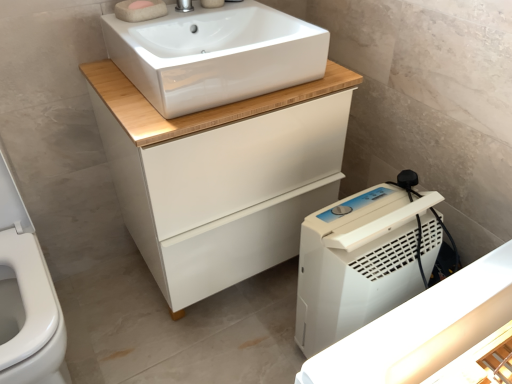
What are the coordinates of `pink sponge at upper center` in the screenshot? It's located at (140, 4).

The image size is (512, 384). What do you see at coordinates (140, 4) in the screenshot?
I see `pink sponge at upper center` at bounding box center [140, 4].

The width and height of the screenshot is (512, 384). What are the coordinates of `white plastic dehumidifier at lower right` in the screenshot? It's located at (361, 262).

Where is `white glossy sink at upper center`? white glossy sink at upper center is located at coordinates (215, 55).

This screenshot has width=512, height=384. In order to click on pink sponge at upper center in this screenshot , I will do `click(140, 4)`.

Can you confirm if pink sponge at upper center is bigger than silver metallic tap at upper center?

Incorrect, pink sponge at upper center is not larger than silver metallic tap at upper center.

The height and width of the screenshot is (384, 512). What are the coordinates of `tap that appears on the right of pink sponge at upper center` in the screenshot? It's located at (184, 6).

Is pink sponge at upper center oriented away from silver metallic tap at upper center?

No.

Do you think pink sponge at upper center is within silver metallic tap at upper center, or outside of it?

pink sponge at upper center is not inside silver metallic tap at upper center, it's outside.

Is pink sponge at upper center looking in the opposite direction of white glossy sink at upper center?

Yes.

How many degrees apart are the facing directions of pink sponge at upper center and white glossy sink at upper center?

The angle between the facing direction of pink sponge at upper center and the facing direction of white glossy sink at upper center is 3.8 degrees.

Is pink sponge at upper center situated inside white glossy sink at upper center or outside?

The correct answer is: inside.

Is pink sponge at upper center not near white glossy sink at upper center?

pink sponge at upper center is near white glossy sink at upper center, not far away.

From the image's perspective, is white plastic dehumidifier at lower right above or below silver metallic tap at upper center?

Clearly, from the image's perspective, white plastic dehumidifier at lower right is below silver metallic tap at upper center.

Is white plastic dehumidifier at lower right positioned with its back to silver metallic tap at upper center?

No, white plastic dehumidifier at lower right is not facing the opposite direction of silver metallic tap at upper center.

Which of these two, white plastic dehumidifier at lower right or silver metallic tap at upper center, is bigger?

white plastic dehumidifier at lower right is bigger.

From a real-world perspective, is silver metallic tap at upper center beneath white plastic dehumidifier at lower right?

No, from a real-world perspective, silver metallic tap at upper center is not below white plastic dehumidifier at lower right.

From the image's perspective, which one is positioned lower, silver metallic tap at upper center or white plastic dehumidifier at lower right?

white plastic dehumidifier at lower right is shown below in the image.

Can you see silver metallic tap at upper center touching white plastic dehumidifier at lower right?

No, silver metallic tap at upper center is not in contact with white plastic dehumidifier at lower right.

Is silver metallic tap at upper center positioned with its back to white plastic dehumidifier at lower right?

No.

From a real-world perspective, is pink sponge at upper center beneath white matte cabinet at center?

No.

Can you confirm if pink sponge at upper center is taller than white matte cabinet at center?

No.

From the image's perspective, which is above, pink sponge at upper center or white matte cabinet at center?

pink sponge at upper center, from the image's perspective.

Is white matte cabinet at center inside pink sponge at upper center?

Actually, white matte cabinet at center is outside pink sponge at upper center.

Which is in front, point (119, 85) or point (138, 7)?

Point (119, 85)

Considering the relative sizes of white matte cabinet at center and pink sponge at upper center in the image provided, is white matte cabinet at center shorter than pink sponge at upper center?

In fact, white matte cabinet at center may be taller than pink sponge at upper center.

From the image's perspective, is white matte cabinet at center located above or below pink sponge at upper center?

Based on their image positions, white matte cabinet at center is located beneath pink sponge at upper center.

At what (x,y) coordinates should I click in order to perform the action: click on tap on the right side of pink sponge at upper center. Please return your answer as a coordinate pair (x, y). This screenshot has height=384, width=512. Looking at the image, I should click on (184, 6).

Is silver metallic tap at upper center not inside pink sponge at upper center?

Yes, silver metallic tap at upper center is located beyond the bounds of pink sponge at upper center.

Is silver metallic tap at upper center bigger or smaller than pink sponge at upper center?

In the image, silver metallic tap at upper center appears to be larger than pink sponge at upper center.

This screenshot has height=384, width=512. I want to click on tap above the pink sponge at upper center (from the image's perspective), so click(x=184, y=6).

Find the location of a particular element. sink below the pink sponge at upper center (from the image's perspective) is located at coordinates (215, 55).

Which object lies nearer to the anchor point white matte cabinet at center, white plastic dehumidifier at lower right or pink sponge at upper center?

white plastic dehumidifier at lower right is positioned closer to the anchor white matte cabinet at center.

From the image, which object appears to be farther from white matte cabinet at center, silver metallic tap at upper center or white glossy sink at upper center?

The object further to white matte cabinet at center is silver metallic tap at upper center.

Which object lies nearer to the anchor point white matte cabinet at center, pink sponge at upper center or silver metallic tap at upper center?

Based on the image, silver metallic tap at upper center appears to be nearer to white matte cabinet at center.

From the image, which object appears to be farther from pink sponge at upper center, white glossy sink at upper center or silver metallic tap at upper center?

The object further to pink sponge at upper center is white glossy sink at upper center.

When comparing their distances from white glossy sink at upper center, does white plastic dehumidifier at lower right or pink sponge at upper center seem closer?

pink sponge at upper center is positioned closer to the anchor white glossy sink at upper center.

Which object lies further to the anchor point silver metallic tap at upper center, white plastic dehumidifier at lower right or pink sponge at upper center?

white plastic dehumidifier at lower right.

When comparing their distances from white plastic dehumidifier at lower right, does white matte cabinet at center or silver metallic tap at upper center seem further?

Based on the image, silver metallic tap at upper center appears to be further to white plastic dehumidifier at lower right.

When comparing their distances from white plastic dehumidifier at lower right, does white glossy sink at upper center or white matte cabinet at center seem closer?

The object closer to white plastic dehumidifier at lower right is white matte cabinet at center.

Image resolution: width=512 pixels, height=384 pixels. I want to click on sink that lies between pink sponge at upper center and white matte cabinet at center from top to bottom, so click(215, 55).

Locate an element on the screen. The height and width of the screenshot is (384, 512). sink between silver metallic tap at upper center and white matte cabinet at center in the up-down direction is located at coordinates (215, 55).

Where is `tap between white glossy sink at upper center and pink sponge at upper center in the front-back direction`? Image resolution: width=512 pixels, height=384 pixels. tap between white glossy sink at upper center and pink sponge at upper center in the front-back direction is located at coordinates (184, 6).

Locate an element on the screen. soap between silver metallic tap at upper center and white matte cabinet at center in the vertical direction is located at coordinates (140, 4).